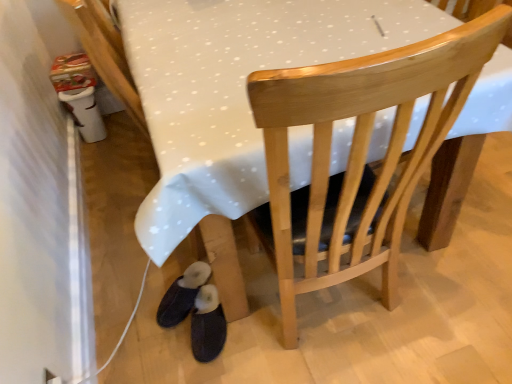
Question: Does black suede slippers at lower left, positioned as the first footwear in left-to-right order, appear on the right side of dark blue fabric slippers at lower left, marked as the 1th footwear in a right-to-left arrangement?

Choices:
 (A) no
 (B) yes

Answer: (A)

Question: Is the position of black suede slippers at lower left, which appears as the 2th footwear when viewed from the right, less distant than that of dark blue fabric slippers at lower left, marked as the 1th footwear in a right-to-left arrangement?

Choices:
 (A) no
 (B) yes

Answer: (A)

Question: Is black suede slippers at lower left, positioned as the first footwear in left-to-right order, oriented towards dark blue fabric slippers at lower left, marked as the 1th footwear in a right-to-left arrangement?

Choices:
 (A) no
 (B) yes

Answer: (A)

Question: Is dark blue fabric slippers at lower left, marked as the 2th footwear in a left-to-right arrangement, a part of black suede slippers at lower left, which appears as the 2th footwear when viewed from the right?

Choices:
 (A) yes
 (B) no

Answer: (B)

Question: Is black suede slippers at lower left, which appears as the 2th footwear when viewed from the right, bigger than dark blue fabric slippers at lower left, marked as the 2th footwear in a left-to-right arrangement?

Choices:
 (A) no
 (B) yes

Answer: (A)

Question: Would you consider black suede slippers at lower left, which appears as the 2th footwear when viewed from the right, to be distant from dark blue fabric slippers at lower left, marked as the 2th footwear in a left-to-right arrangement?

Choices:
 (A) yes
 (B) no

Answer: (B)

Question: Is dark blue fabric slippers at lower left, marked as the 2th footwear in a left-to-right arrangement, located within wooden chair at center?

Choices:
 (A) no
 (B) yes

Answer: (A)

Question: Considering the relative sizes of wooden chair at center and dark blue fabric slippers at lower left, marked as the 2th footwear in a left-to-right arrangement, in the image provided, is wooden chair at center smaller than dark blue fabric slippers at lower left, marked as the 2th footwear in a left-to-right arrangement,?

Choices:
 (A) yes
 (B) no

Answer: (B)

Question: Does wooden chair at center have a greater height compared to dark blue fabric slippers at lower left, marked as the 1th footwear in a right-to-left arrangement?

Choices:
 (A) yes
 (B) no

Answer: (A)

Question: Is wooden chair at center not inside dark blue fabric slippers at lower left, marked as the 1th footwear in a right-to-left arrangement?

Choices:
 (A) no
 (B) yes

Answer: (B)

Question: From the image's perspective, is wooden chair at center over dark blue fabric slippers at lower left, marked as the 1th footwear in a right-to-left arrangement?

Choices:
 (A) yes
 (B) no

Answer: (A)

Question: Considering the relative positions of wooden chair at center and dark blue fabric slippers at lower left, marked as the 1th footwear in a right-to-left arrangement, in the image provided, is wooden chair at center to the left of dark blue fabric slippers at lower left, marked as the 1th footwear in a right-to-left arrangement, from the viewer's perspective?

Choices:
 (A) yes
 (B) no

Answer: (B)

Question: Is wooden chair at center positioned in front of black suede slippers at lower left, positioned as the first footwear in left-to-right order?

Choices:
 (A) no
 (B) yes

Answer: (B)